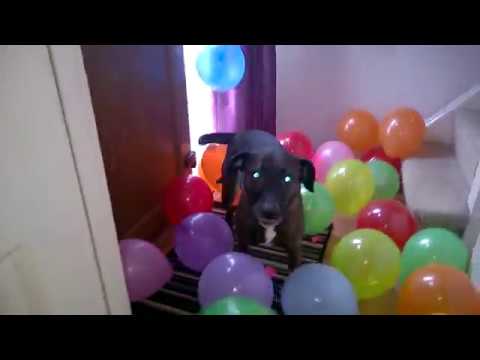
Where is `door`? door is located at coordinates (142, 103).